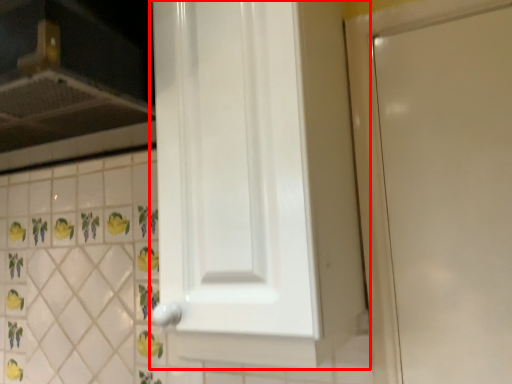
Question: From the image's perspective, what is the correct spatial positioning of door (annotated by the red box) in reference to vent?

Choices:
 (A) above
 (B) below

Answer: (B)